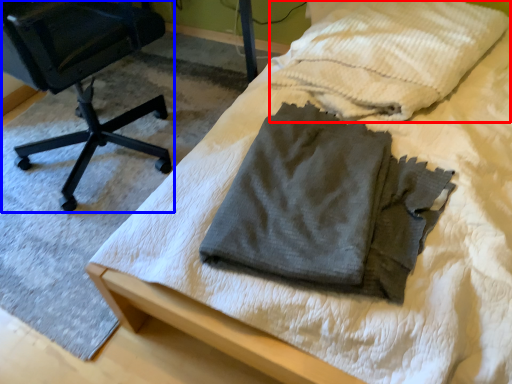
Question: Which point is closer to the camera, cloth (highlighted by a red box) or chair (highlighted by a blue box)?

Choices:
 (A) cloth
 (B) chair

Answer: (B)